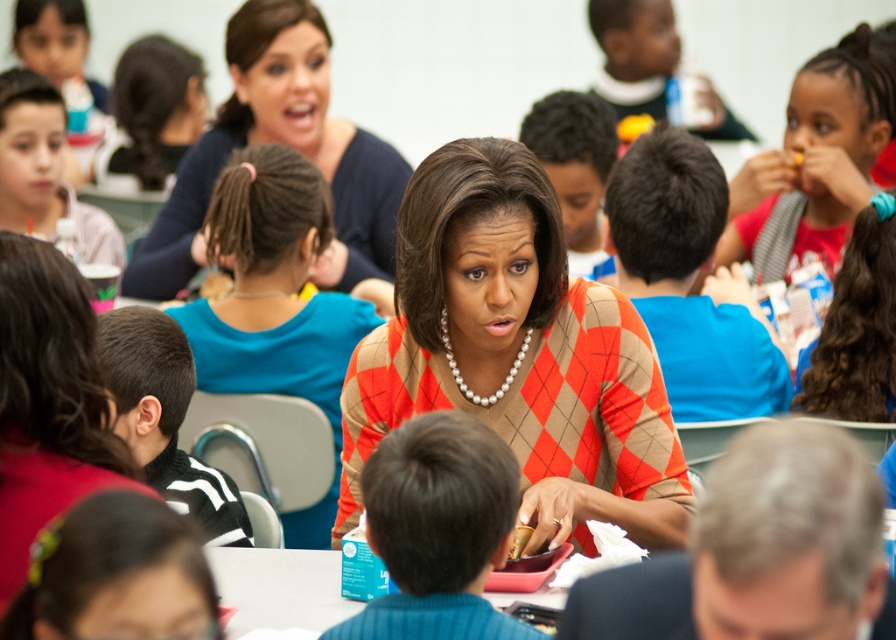
Question: Which point is closer to the camera?

Choices:
 (A) black fleece jacket at left
 (B) orange argyle sweater at center
 (C) blue plastic table at center

Answer: (C)

Question: Which point is closer to the camera taking this photo?

Choices:
 (A) (187, 397)
 (B) (187, 168)

Answer: (A)

Question: Does orange argyle sweater at center have a smaller size compared to blue fabric shirt at center?

Choices:
 (A) no
 (B) yes

Answer: (A)

Question: Is black fleece jacket at left to the right of matte plastic water bottle at left from the viewer's perspective?

Choices:
 (A) yes
 (B) no

Answer: (A)

Question: Which of the following is the farthest from the observer?

Choices:
 (A) blue plastic table at center
 (B) matte plastic water bottle at left

Answer: (B)

Question: Is orange argyle sweater at center smaller than black fleece jacket at left?

Choices:
 (A) yes
 (B) no

Answer: (B)